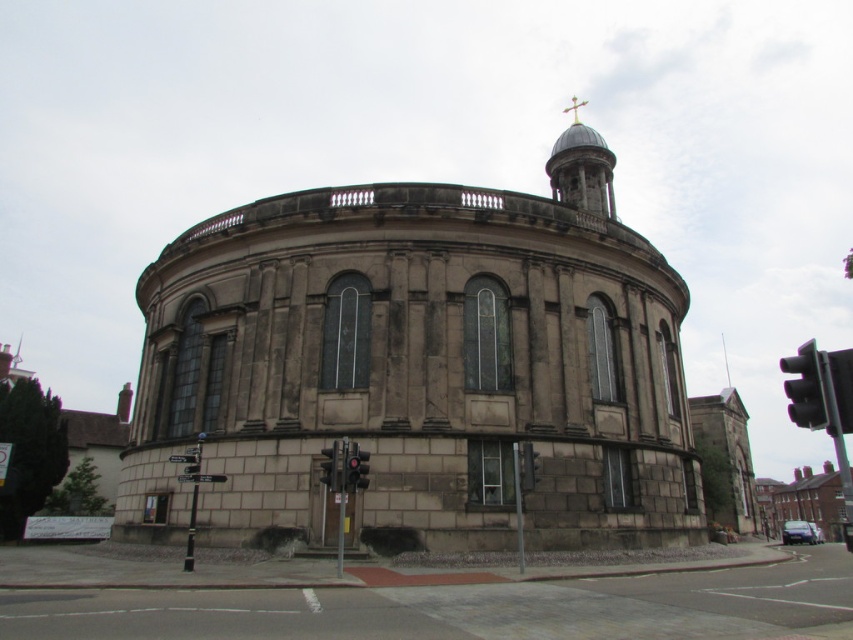
Question: Which point is farther to the camera?

Choices:
 (A) metallic traffic light at lower center
 (B) black glass traffic light at right
 (C) stone church at center

Answer: (C)

Question: Considering the relative positions of stone church at center and metallic traffic light at lower center in the image provided, where is stone church at center located with respect to metallic traffic light at lower center?

Choices:
 (A) left
 (B) right

Answer: (B)

Question: Can you confirm if stone church at center is bigger than metallic traffic light at lower center?

Choices:
 (A) no
 (B) yes

Answer: (B)

Question: Estimate the real-world distances between objects in this image. Which object is farther from the metallic traffic light at lower center?

Choices:
 (A) black glass traffic light at right
 (B) stone church at center

Answer: (A)

Question: Among these points, which one is farthest from the camera?

Choices:
 (A) pos(339,477)
 (B) pos(248,497)
 (C) pos(781,371)

Answer: (C)

Question: In this image, where is black glass traffic light at right located relative to metallic traffic light at lower center?

Choices:
 (A) left
 (B) right

Answer: (B)